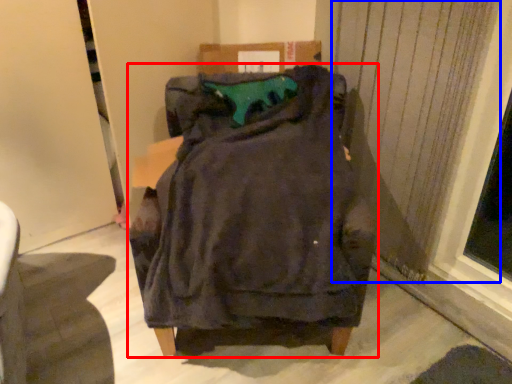
Question: Which object appears closest to the camera in this image, furniture (highlighted by a red box) or curtain (highlighted by a blue box)?

Choices:
 (A) furniture
 (B) curtain

Answer: (A)